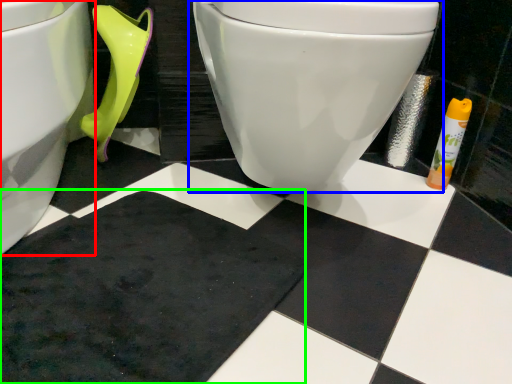
Question: Which object is positioned farthest from toilet (highlighted by a red box)? Select from toilet (highlighted by a blue box) and bath mat (highlighted by a green box).

Choices:
 (A) toilet
 (B) bath mat

Answer: (A)